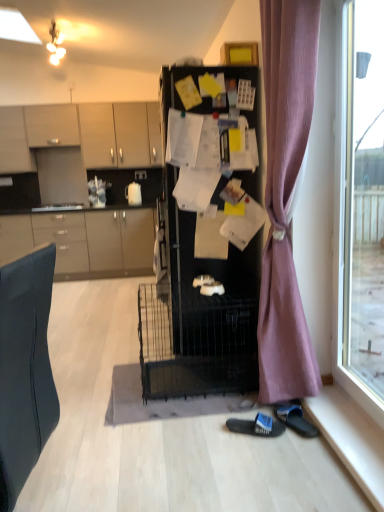
Question: Is black fabric slipper at lower center, the 2th footwear positioned from the right, thinner than matte white cabinet at upper left, which appears as the 1th cabinetry when viewed from the top?

Choices:
 (A) no
 (B) yes

Answer: (B)

Question: From a real-world perspective, is black fabric slipper at lower center, acting as the 1th footwear starting from the left, on matte white cabinet at upper left, which appears as the 1th cabinetry when viewed from the top?

Choices:
 (A) no
 (B) yes

Answer: (A)

Question: Can you see black fabric slipper at lower center, the 2th footwear positioned from the right, touching matte white cabinet at upper left, which appears as the 1th cabinetry when viewed from the top?

Choices:
 (A) yes
 (B) no

Answer: (B)

Question: Is the position of black fabric slipper at lower center, the 2th footwear positioned from the right, more distant than that of matte white cabinet at upper left, which appears as the 1th cabinetry when viewed from the top?

Choices:
 (A) yes
 (B) no

Answer: (B)

Question: Would you say matte white cabinet at upper left, the 4th cabinetry positioned from the bottom, is part of black fabric slipper at lower center, the 2th footwear positioned from the right,'s contents?

Choices:
 (A) no
 (B) yes

Answer: (A)

Question: In the image, is matte white cabinet at upper left, the 4th cabinetry positioned from the bottom, on the left side or the right side of white matte teapot at upper center?

Choices:
 (A) right
 (B) left

Answer: (B)

Question: Considering their positions, is matte white cabinet at upper left, which appears as the 1th cabinetry when viewed from the top, located in front of or behind white matte teapot at upper center?

Choices:
 (A) behind
 (B) front

Answer: (B)

Question: Looking at the image, does matte white cabinet at upper left, the 4th cabinetry positioned from the bottom, seem bigger or smaller compared to white matte teapot at upper center?

Choices:
 (A) small
 (B) big

Answer: (B)

Question: Considering the positions of matte white cabinet at upper left, which appears as the 1th cabinetry when viewed from the top, and white matte teapot at upper center in the image, is matte white cabinet at upper left, which appears as the 1th cabinetry when viewed from the top, taller or shorter than white matte teapot at upper center?

Choices:
 (A) short
 (B) tall

Answer: (B)

Question: Is black fabric slipper at lower center, acting as the 1th footwear starting from the left, inside or outside of white glossy sink at left?

Choices:
 (A) outside
 (B) inside

Answer: (A)

Question: From the image's perspective, relative to white glossy sink at left, is black fabric slipper at lower center, the 2th footwear positioned from the right, above or below?

Choices:
 (A) below
 (B) above

Answer: (A)

Question: Would you say black fabric slipper at lower center, acting as the 1th footwear starting from the left, is to the left or to the right of white glossy sink at left in the picture?

Choices:
 (A) right
 (B) left

Answer: (A)

Question: From a real-world perspective, relative to white glossy sink at left, is black fabric slipper at lower center, acting as the 1th footwear starting from the left, vertically above or below?

Choices:
 (A) below
 (B) above

Answer: (A)

Question: Is black rubber slipper at lower right, acting as the first footwear starting from the right, in front of or behind purple fabric curtain at right in the image?

Choices:
 (A) front
 (B) behind

Answer: (B)

Question: Is black rubber slipper at lower right, acting as the first footwear starting from the right, taller or shorter than purple fabric curtain at right?

Choices:
 (A) tall
 (B) short

Answer: (B)